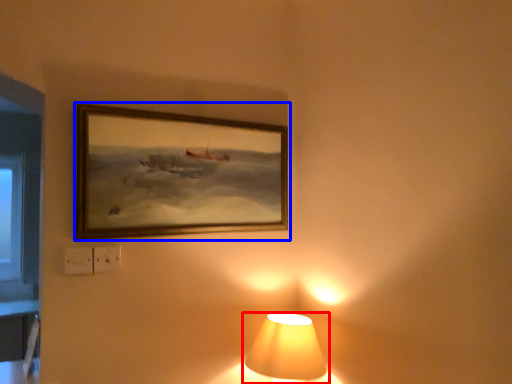
Question: Which object is further to the camera taking this photo, lamp (highlighted by a red box) or picture frame (highlighted by a blue box)?

Choices:
 (A) lamp
 (B) picture frame

Answer: (B)